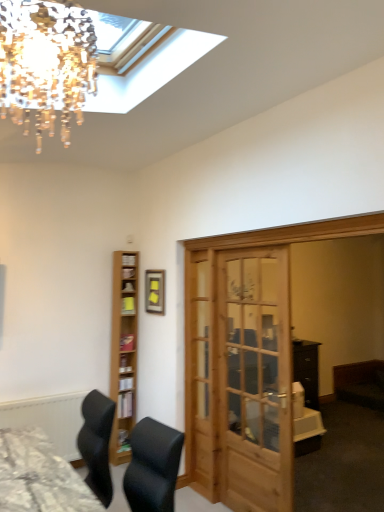
Where is `free space above textured gray desk at lower left (from a real-world perspective)`? free space above textured gray desk at lower left (from a real-world perspective) is located at coordinates click(15, 459).